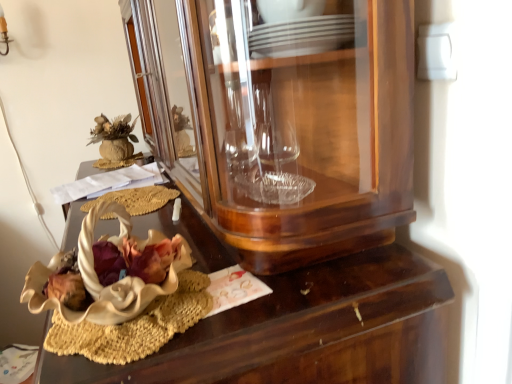
Question: From a real-world perspective, relative to white matte flower at center, is wooden desk at center vertically above or below?

Choices:
 (A) below
 (B) above

Answer: (A)

Question: Considering their positions, is wooden desk at center located in front of or behind white matte flower at center?

Choices:
 (A) front
 (B) behind

Answer: (A)

Question: Estimate the real-world distances between objects in this image. Which object is closer to the white matte flower at center?

Choices:
 (A) wooden desk at center
 (B) transparent glass cabinet at center

Answer: (A)

Question: Estimate the real-world distances between objects in this image. Which object is closer to the white matte flower at center?

Choices:
 (A) transparent glass cabinet at center
 (B) wooden desk at center

Answer: (B)